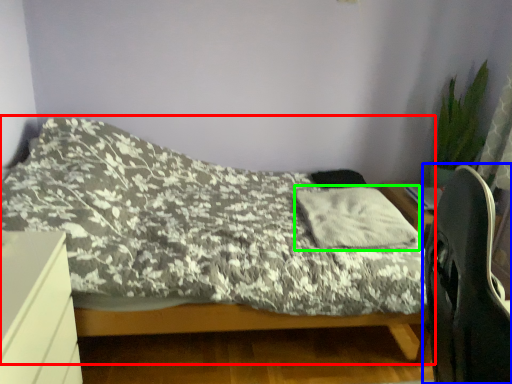
Question: Estimate the real-world distances between objects in this image. Which object is closer to bed (highlighted by a red box), computer chair (highlighted by a blue box) or pillow (highlighted by a green box)?

Choices:
 (A) computer chair
 (B) pillow

Answer: (B)